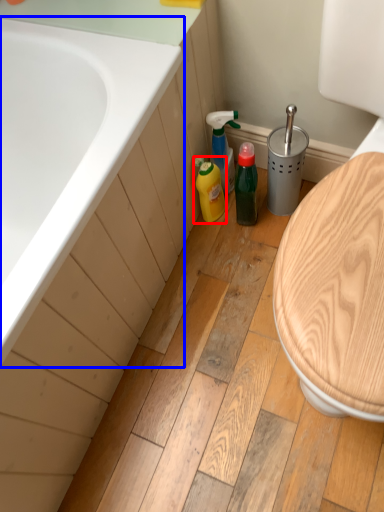
Question: Which object appears farthest to the camera in this image, cleaning product (highlighted by a red box) or bathtub (highlighted by a blue box)?

Choices:
 (A) cleaning product
 (B) bathtub

Answer: (A)